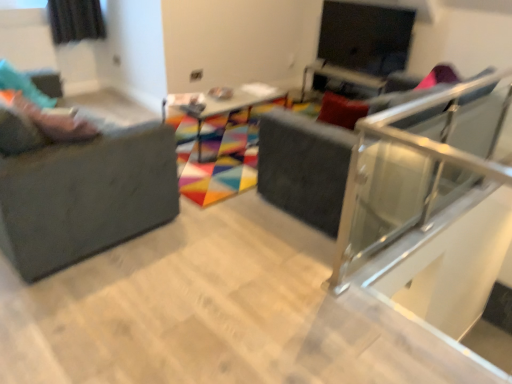
Question: From their relative heights in the image, would you say matte gray studio couch at left is taller or shorter than matte black screen at upper right?

Choices:
 (A) short
 (B) tall

Answer: (B)

Question: Relative to matte black screen at upper right, is matte gray studio couch at left in front or behind?

Choices:
 (A) behind
 (B) front

Answer: (B)

Question: Considering the real-world distances, which object is farthest from the wooden table at center?

Choices:
 (A) matte gray studio couch at left
 (B) matte pink shoes at left
 (C) matte black screen at upper right
 (D) matte black swivel chair at center

Answer: (A)

Question: Considering the real-world distances, which object is farthest from the wooden table at center?

Choices:
 (A) matte gray studio couch at left
 (B) matte pink shoes at left
 (C) matte black screen at upper right
 (D) matte black swivel chair at center

Answer: (A)